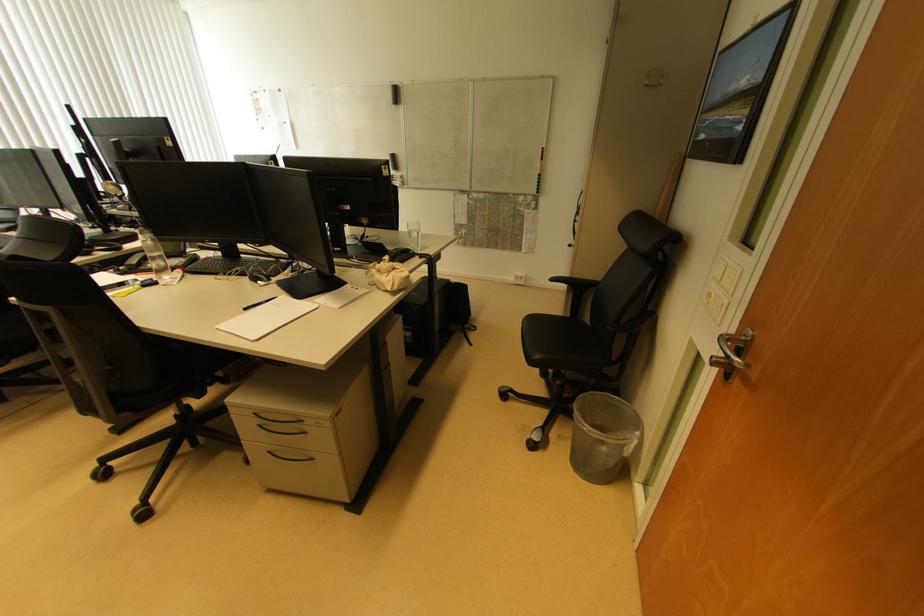
This screenshot has height=616, width=924. What do you see at coordinates (393, 161) in the screenshot?
I see `the whiteboard eraser` at bounding box center [393, 161].